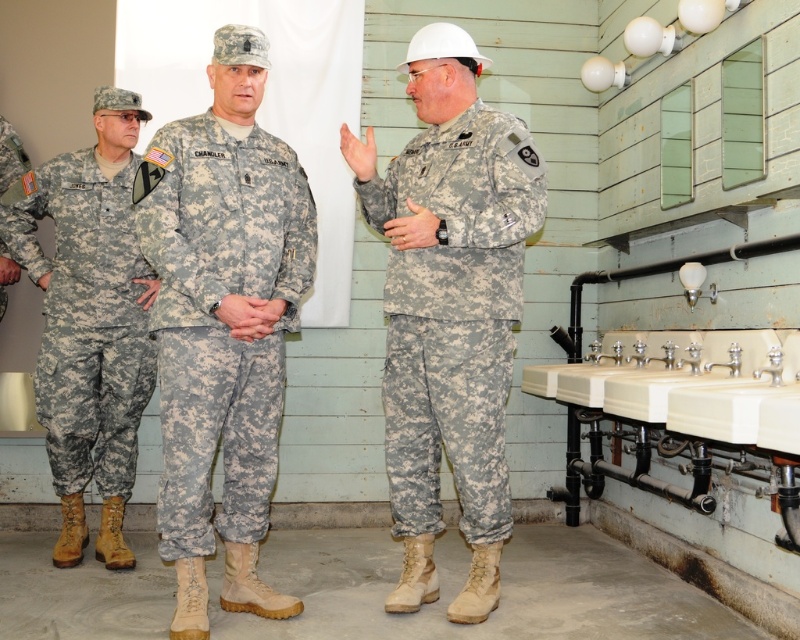
Based on the photo, you are an army inspector checking the clothing of two soldiers. You notice the camouflage fabric uniform at center and the camouflage fabric pants at left. Which clothing item has a thinner material?

The camouflage fabric uniform at center has a thinner material than the camouflage fabric pants at left.

You are an observer in the scene described. You need to determine which piece of clothing is nearer to you between the camouflage fabric uniform at center and the camouflage fabric pants at left. Which one is closer?

The camouflage fabric uniform at center is closer to the viewer than the camouflage fabric pants at left.

You are a tailor who needs to compare the thickness of two items in the scene. Which object is thinner between the camouflage fabric pants at center and the white ceramic sink at lower right?

The camouflage fabric pants at center is thinner than the white ceramic sink at lower right according to the description.